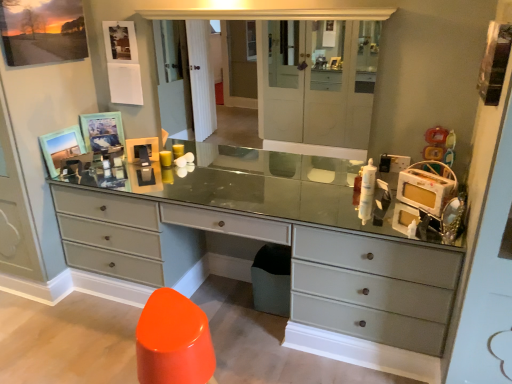
Question: Relative to matte glass medicine cabinet at center, is matte gray dresser at center in front or behind?

Choices:
 (A) behind
 (B) front

Answer: (B)

Question: Looking at their shapes, would you say matte gray dresser at center is wider or thinner than matte glass medicine cabinet at center?

Choices:
 (A) thin
 (B) wide

Answer: (B)

Question: Considering the real-world distances, which object is farthest from the matte wooden picture frame at upper left, which is the third picture frame from top to bottom?

Choices:
 (A) matte glass medicine cabinet at center
 (B) matte gray dresser at center
 (C) wooden picture frame at upper left, marked as the second picture frame in a bottom-to-top arrangement
 (D) plastic yellow toy at upper right
 (E) matte wooden picture frame at upper left, which is counted as the 3th picture frame, starting from the bottom

Answer: (D)

Question: Estimate the real-world distances between objects in this image. Which object is closer to the plastic yellow toy at upper right?

Choices:
 (A) matte wooden picture frame at upper left, which is the third picture frame from top to bottom
 (B) matte glass medicine cabinet at center
 (C) wooden picture frame at upper left, which is the second picture frame from top to bottom
 (D) matte wooden picture frame at upper left, which is counted as the 3th picture frame, starting from the bottom
 (E) matte gray dresser at center

Answer: (B)